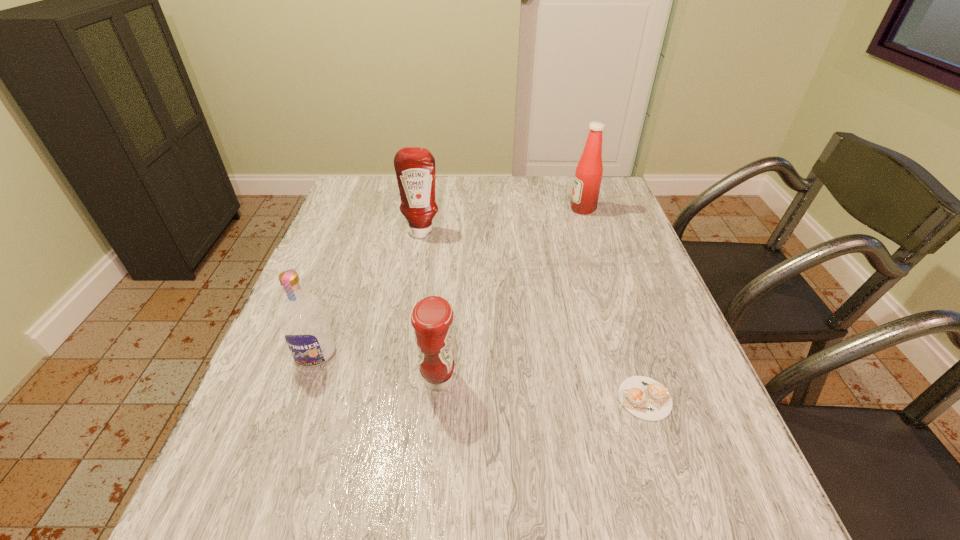
At what (x,y) coordinates should I click in order to perform the action: click on free region at the right edge of the desktop. Please return your answer as a coordinate pair (x, y). The height and width of the screenshot is (540, 960). Looking at the image, I should click on (585, 239).

The width and height of the screenshot is (960, 540). Identify the location of free space at the far left corner. (384, 208).

Where is `free spot between the rightmost condiment and the fourth nearest object`? free spot between the rightmost condiment and the fourth nearest object is located at coordinates (502, 220).

This screenshot has width=960, height=540. In order to click on free space between the shortest condiment and the leftmost object in this screenshot , I will do `click(377, 367)`.

Where is `free space between the shortest object and the rightmost condiment`? The height and width of the screenshot is (540, 960). free space between the shortest object and the rightmost condiment is located at coordinates (613, 303).

Where is `vacant space that is in between the leftmost object and the shortest condiment`? vacant space that is in between the leftmost object and the shortest condiment is located at coordinates (377, 367).

This screenshot has width=960, height=540. Find the location of `vacant space in between the cappuccino and the shortest condiment`. vacant space in between the cappuccino and the shortest condiment is located at coordinates (541, 389).

The height and width of the screenshot is (540, 960). I want to click on empty location between the vodka and the rightmost condiment, so click(x=449, y=281).

This screenshot has width=960, height=540. What are the coordinates of `vacant area that lies between the rightmost condiment and the second farthest condiment` in the screenshot? It's located at tap(502, 220).

The height and width of the screenshot is (540, 960). I want to click on vacant space in between the vodka and the nearest condiment, so click(377, 367).